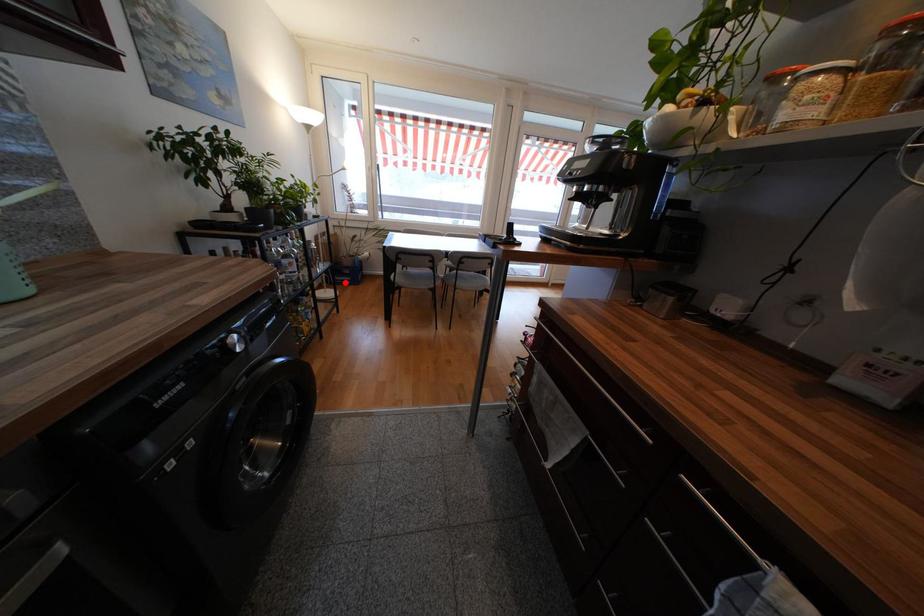
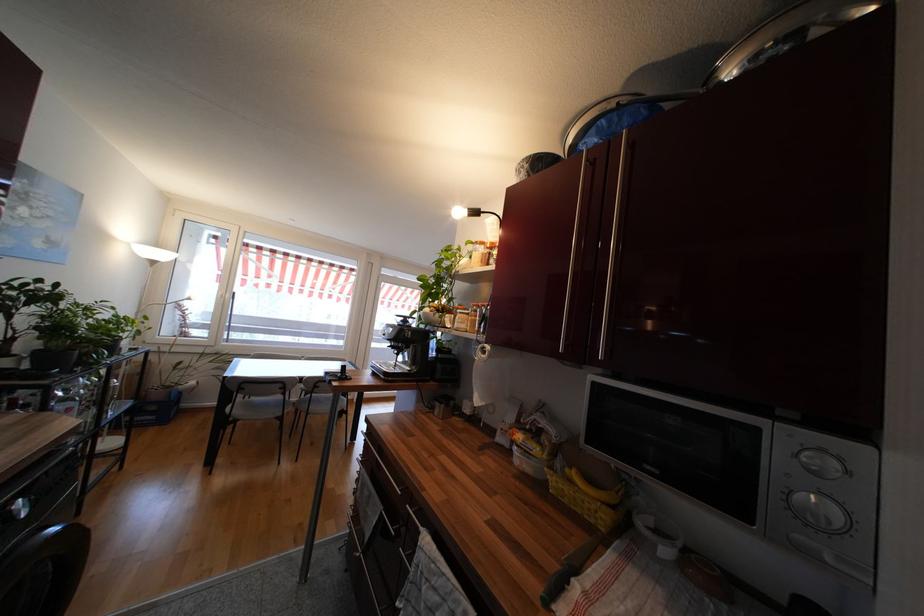
The point at the highlighted location is marked in the first image. Where is the corresponding point in the second image?

(141, 424)